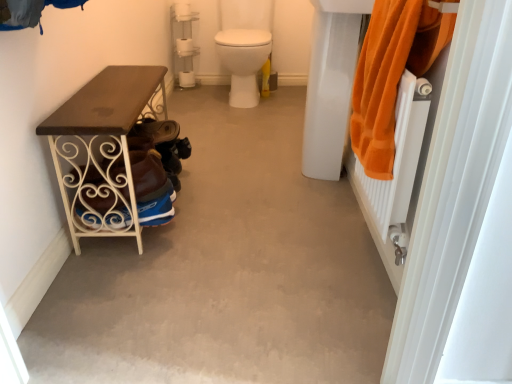
Question: Does smooth concrete floor at center have a lesser width compared to white glossy sink at upper right?

Choices:
 (A) no
 (B) yes

Answer: (A)

Question: Can you confirm if smooth concrete floor at center is bigger than white glossy sink at upper right?

Choices:
 (A) yes
 (B) no

Answer: (A)

Question: Is smooth concrete floor at center touching white glossy sink at upper right?

Choices:
 (A) yes
 (B) no

Answer: (B)

Question: Is smooth concrete floor at center turned away from white glossy sink at upper right?

Choices:
 (A) yes
 (B) no

Answer: (B)

Question: Considering the relative sizes of smooth concrete floor at center and white glossy sink at upper right in the image provided, is smooth concrete floor at center taller than white glossy sink at upper right?

Choices:
 (A) yes
 (B) no

Answer: (B)

Question: From a real-world perspective, is smooth concrete floor at center physically below white glossy sink at upper right?

Choices:
 (A) yes
 (B) no

Answer: (A)

Question: Is brown wood table at left thinner than orange terry cloth towel at right?

Choices:
 (A) no
 (B) yes

Answer: (A)

Question: From a real-world perspective, is brown wood table at left positioned over orange terry cloth towel at right based on gravity?

Choices:
 (A) no
 (B) yes

Answer: (A)

Question: Can you confirm if brown wood table at left is positioned to the right of orange terry cloth towel at right?

Choices:
 (A) no
 (B) yes

Answer: (A)

Question: From the image's perspective, is brown wood table at left beneath orange terry cloth towel at right?

Choices:
 (A) yes
 (B) no

Answer: (A)

Question: Is orange terry cloth towel at right a part of brown wood table at left?

Choices:
 (A) yes
 (B) no

Answer: (B)

Question: From the image's perspective, is brown wood table at left on top of orange terry cloth towel at right?

Choices:
 (A) yes
 (B) no

Answer: (B)

Question: From a real-world perspective, is smooth concrete floor at center over brown suede shoe at lower left?

Choices:
 (A) yes
 (B) no

Answer: (B)